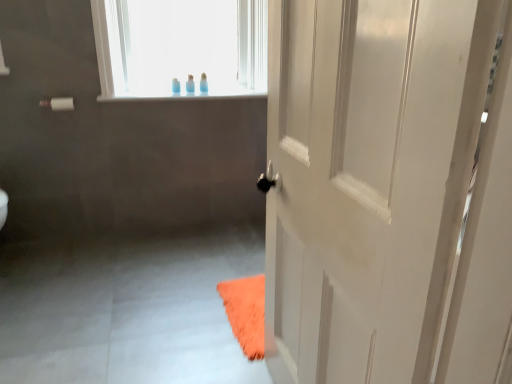
Question: From a real-world perspective, is translucent plastic toothbrush at upper center, the second toiletry in the left-to-right sequence, on white glossy door at right?

Choices:
 (A) yes
 (B) no

Answer: (A)

Question: Are translucent plastic toothbrush at upper center, which is the first toiletry from right to left, and white glossy door at right far apart?

Choices:
 (A) no
 (B) yes

Answer: (B)

Question: From a real-world perspective, is translucent plastic toothbrush at upper center, which is the first toiletry from right to left, below white glossy door at right?

Choices:
 (A) yes
 (B) no

Answer: (B)

Question: Is translucent plastic toothbrush at upper center, which is the first toiletry from right to left, thinner than white glossy door at right?

Choices:
 (A) yes
 (B) no

Answer: (A)

Question: Is white glossy door at right a part of translucent plastic toothbrush at upper center, which is the first toiletry from right to left?

Choices:
 (A) yes
 (B) no

Answer: (B)

Question: Considering the positions of point (185, 82) and point (67, 105), is point (185, 82) closer or farther from the camera than point (67, 105)?

Choices:
 (A) farther
 (B) closer

Answer: (A)

Question: In terms of width, does translucent plastic toothbrush at upper center, which is the first toiletry from right to left, look wider or thinner when compared to white matte towel bar at upper left?

Choices:
 (A) wide
 (B) thin

Answer: (B)

Question: Is translucent plastic toothbrush at upper center, which is the first toiletry from right to left, taller or shorter than white matte towel bar at upper left?

Choices:
 (A) tall
 (B) short

Answer: (A)

Question: Would you say translucent plastic toothbrush at upper center, the second toiletry in the left-to-right sequence, is to the left or to the right of white matte towel bar at upper left in the picture?

Choices:
 (A) right
 (B) left

Answer: (A)

Question: From a real-world perspective, is translucent plastic bottle at upper center, the 1th toiletry from the left, positioned above or below white glossy door at right?

Choices:
 (A) above
 (B) below

Answer: (A)

Question: Choose the correct answer: Is translucent plastic bottle at upper center, the 1th toiletry from the left, inside white glossy door at right or outside it?

Choices:
 (A) inside
 (B) outside

Answer: (B)

Question: Would you say translucent plastic bottle at upper center, marked as the second toiletry in a right-to-left arrangement, is to the left or to the right of white glossy door at right in the picture?

Choices:
 (A) left
 (B) right

Answer: (A)

Question: In terms of height, does translucent plastic bottle at upper center, marked as the second toiletry in a right-to-left arrangement, look taller or shorter compared to white glossy door at right?

Choices:
 (A) short
 (B) tall

Answer: (A)

Question: Considering their positions, is white matte towel bar at upper left located in front of or behind translucent plastic toothbrush at upper center, which is the first toiletry from right to left?

Choices:
 (A) behind
 (B) front

Answer: (B)

Question: From their relative heights in the image, would you say white matte towel bar at upper left is taller or shorter than translucent plastic toothbrush at upper center, the second toiletry in the left-to-right sequence?

Choices:
 (A) short
 (B) tall

Answer: (A)